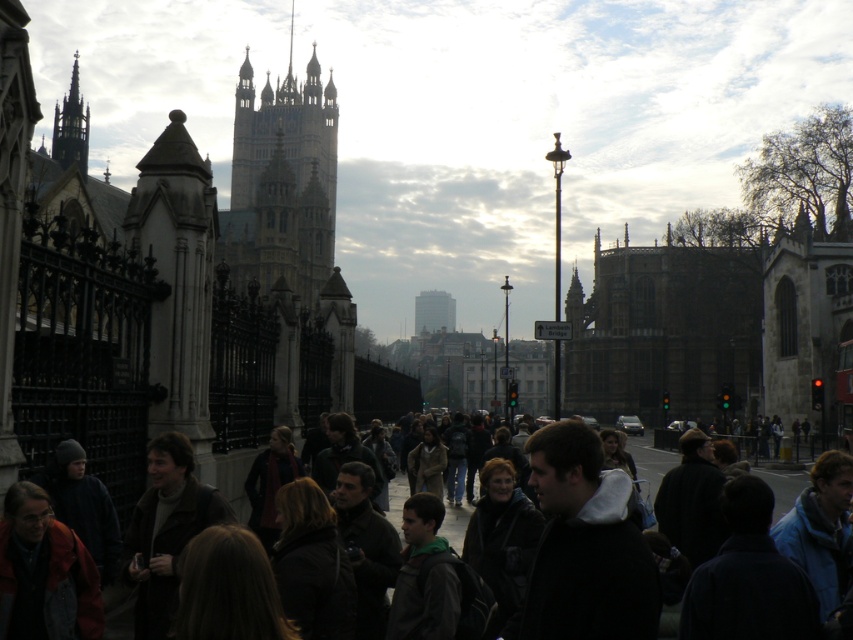
You are a tourist in London and you want to take a photo of the golden stone tower at upper center. However, there is a person wearing a dark brown leather jacket at center blocking your view. Based on their height, can you see the top of the tower over their head?

The golden stone tower at upper center is taller than the dark brown leather jacket at center, so yes, you can see the top of the tower over the person wearing the dark brown leather jacket at center.

Based on the scene description, if you were to compare the golden stone tower at upper center and the dark gray stone spire at upper left, which one appears wider from your viewpoint?

The golden stone tower at upper center appears wider than the dark gray stone spire at upper left.